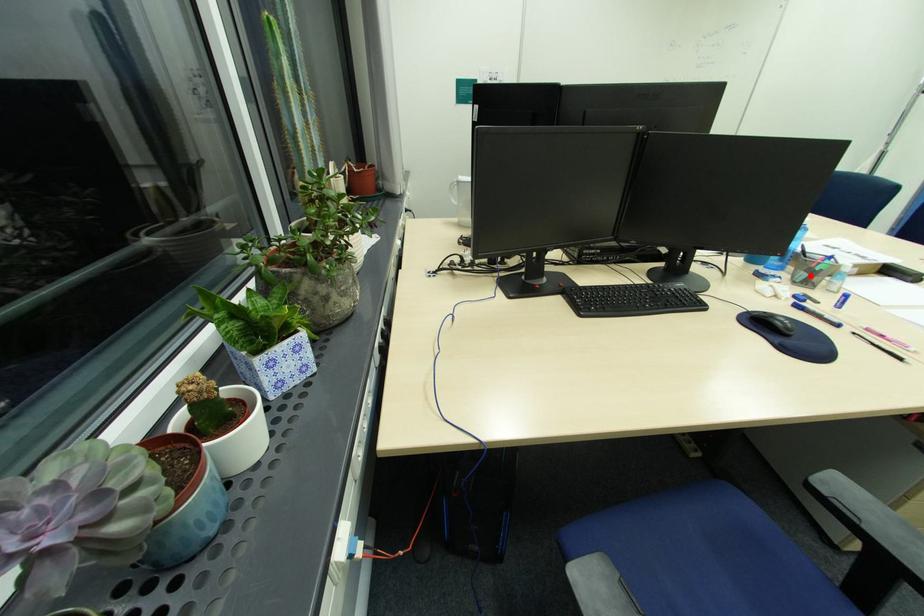
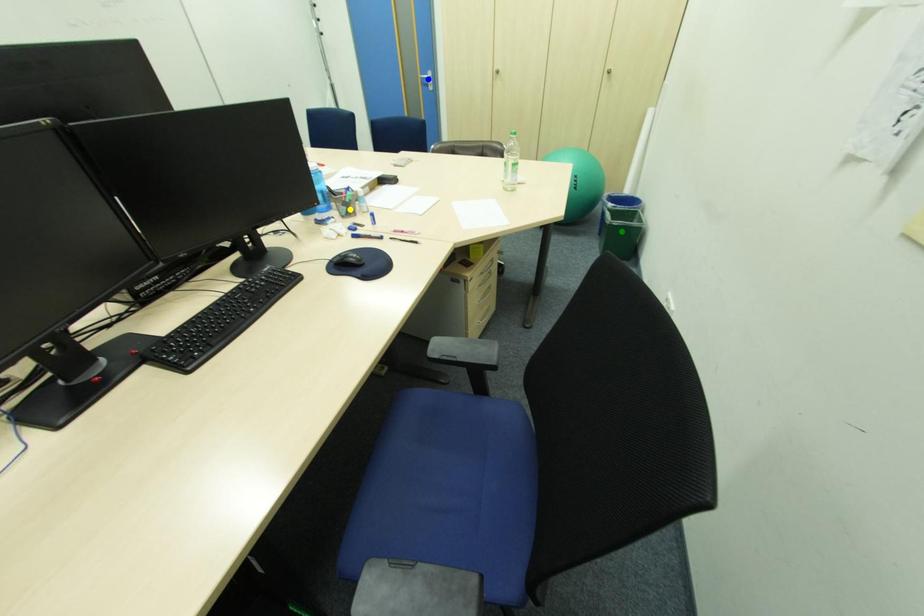
Question: I am providing you with two images of the same scene from different viewpoints. A red point is marked on the first image. You are given multiple points on the second image. In image 2, which mark is for the same physical point as the one in image 1?

Choices:
 (A) green point
 (B) yellow point
 (C) blue point

Answer: (B)